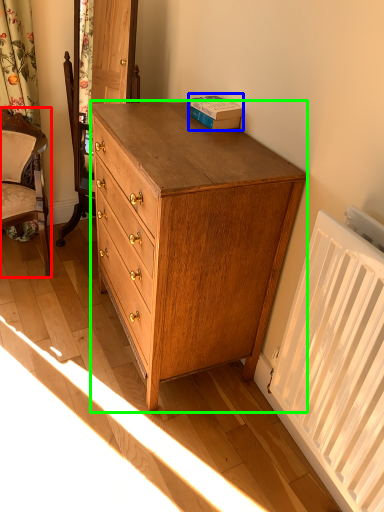
Question: Which object is the closest to the chair (highlighted by a red box)? Choose among these: book (highlighted by a blue box) or chest of drawers (highlighted by a green box).

Choices:
 (A) book
 (B) chest of drawers

Answer: (B)